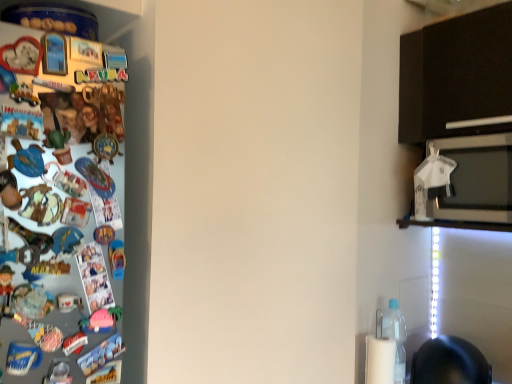
Question: Does white plastic umbrella at upper right have a smaller size compared to clear plastic bottle at lower right?

Choices:
 (A) no
 (B) yes

Answer: (B)

Question: Considering the relative sizes of white plastic umbrella at upper right and clear plastic bottle at lower right in the image provided, is white plastic umbrella at upper right wider than clear plastic bottle at lower right?

Choices:
 (A) yes
 (B) no

Answer: (B)

Question: Does white plastic umbrella at upper right appear on the left side of clear plastic bottle at lower right?

Choices:
 (A) no
 (B) yes

Answer: (A)

Question: Is white plastic umbrella at upper right aimed at clear plastic bottle at lower right?

Choices:
 (A) no
 (B) yes

Answer: (A)

Question: From the image's perspective, is white plastic umbrella at upper right located beneath clear plastic bottle at lower right?

Choices:
 (A) yes
 (B) no

Answer: (B)

Question: Is white plastic umbrella at upper right not inside clear plastic bottle at lower right?

Choices:
 (A) yes
 (B) no

Answer: (A)

Question: From the image's perspective, is clear plastic bottle at lower right over white plastic umbrella at upper right?

Choices:
 (A) no
 (B) yes

Answer: (A)

Question: Are clear plastic bottle at lower right and white plastic umbrella at upper right far apart?

Choices:
 (A) no
 (B) yes

Answer: (A)

Question: From a real-world perspective, is clear plastic bottle at lower right physically above white plastic umbrella at upper right?

Choices:
 (A) yes
 (B) no

Answer: (B)

Question: Is clear plastic bottle at lower right positioned before white plastic umbrella at upper right?

Choices:
 (A) no
 (B) yes

Answer: (A)

Question: Does clear plastic bottle at lower right have a greater width compared to white plastic umbrella at upper right?

Choices:
 (A) yes
 (B) no

Answer: (A)

Question: Is white plastic umbrella at upper right completely or partially inside clear plastic bottle at lower right?

Choices:
 (A) no
 (B) yes

Answer: (A)

Question: Considering the relative sizes of white glossy microwave oven at upper right and white plastic umbrella at upper right in the image provided, is white glossy microwave oven at upper right bigger than white plastic umbrella at upper right?

Choices:
 (A) yes
 (B) no

Answer: (A)